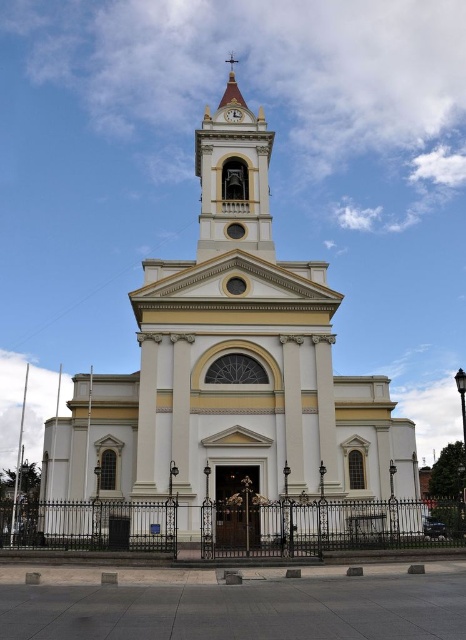
Consider the image. Can you confirm if white smooth church at center is thinner than smooth cream steeple at center?

In fact, white smooth church at center might be wider than smooth cream steeple at center.

Between white smooth church at center and smooth cream steeple at center, which one is positioned lower?

white smooth church at center is below.

Where is `white smooth church at center`? white smooth church at center is located at coordinates (228, 385).

Does point (87, 403) lie behind point (242, 115)?

No, it is in front of (242, 115).

Does white smooth church at center have a greater width compared to white textured clock at center?

Yes, white smooth church at center is wider than white textured clock at center.

Which is in front, point (219, 248) or point (238, 112)?

Positioned in front is point (219, 248).

Find the location of a particular element. This screenshot has width=466, height=640. white smooth church at center is located at coordinates (228, 385).

Is smooth cream steeple at center to the right of white textured clock at center from the viewer's perspective?

In fact, smooth cream steeple at center is to the left of white textured clock at center.

What do you see at coordinates (233, 179) in the screenshot?
I see `smooth cream steeple at center` at bounding box center [233, 179].

Where is `smooth cream steeple at center`? The height and width of the screenshot is (640, 466). smooth cream steeple at center is located at coordinates (233, 179).

Locate an element on the screen. smooth cream steeple at center is located at coordinates (233, 179).